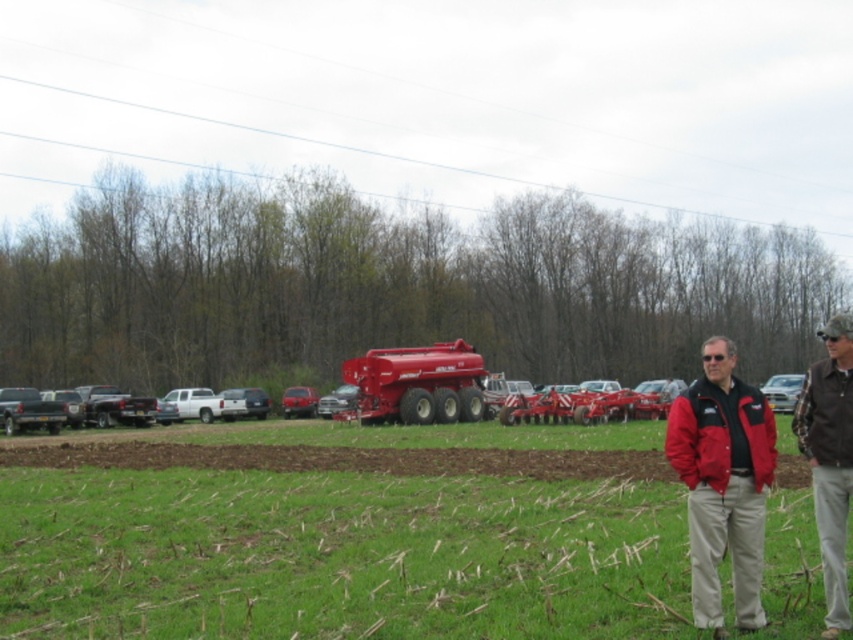
Is point (705, 522) less distant than point (781, 372)?

Yes, it is in front of point (781, 372).

Who is more forward, (727, 460) or (767, 396)?

Point (727, 460) is more forward.

In order to click on red softshell jacket at lower right in this screenshot , I will do `click(723, 483)`.

Can you confirm if green grass at center is positioned above white glossy car at right?

Correct, green grass at center is located above white glossy car at right.

Which is more to the left, green grass at center or white glossy car at right?

Positioned to the left is green grass at center.

Based on the photo, who is more forward, (x=376, y=474) or (x=775, y=374)?

Point (x=376, y=474) is more forward.

Where is `green grass at center`? Image resolution: width=853 pixels, height=640 pixels. green grass at center is located at coordinates (337, 556).

Which is below, green grass at center or brown/cotton shirt at lower right?

green grass at center is below.

This screenshot has width=853, height=640. I want to click on green grass at center, so click(337, 556).

In order to click on green grass at center in this screenshot , I will do `click(337, 556)`.